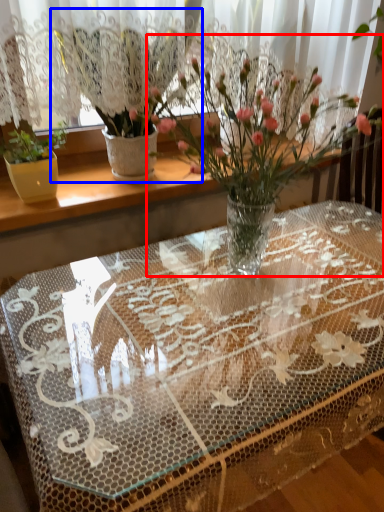
Question: Which point is further to the camera, houseplant (highlighted by a red box) or houseplant (highlighted by a blue box)?

Choices:
 (A) houseplant
 (B) houseplant

Answer: (B)